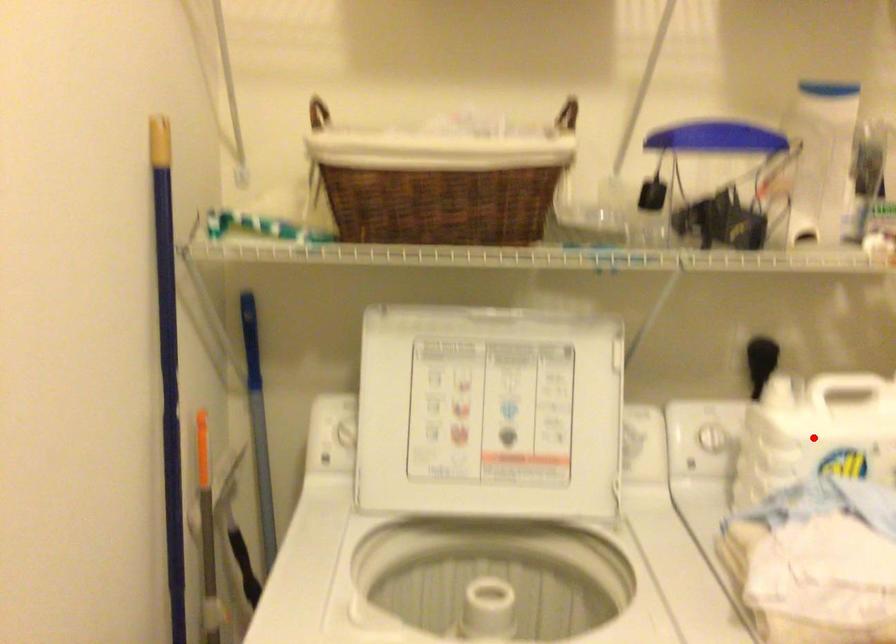
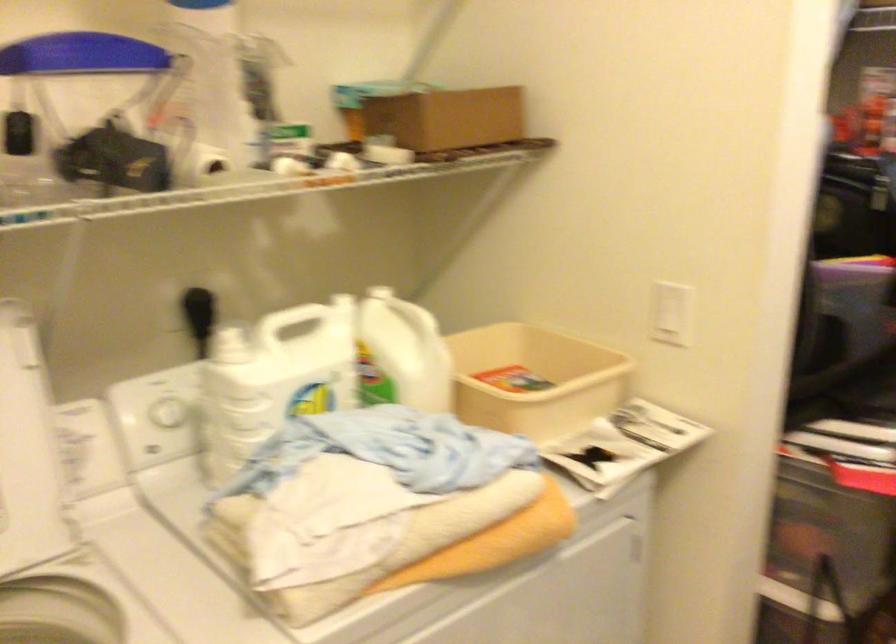
In the second image, find the point that corresponds to the highlighted location in the first image.

(273, 379)